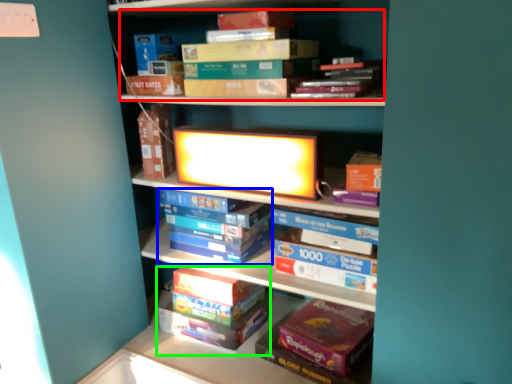
Question: Which object is the farthest from book (highlighted by a red box)? Choose among these: book (highlighted by a blue box) or book (highlighted by a green box).

Choices:
 (A) book
 (B) book

Answer: (B)